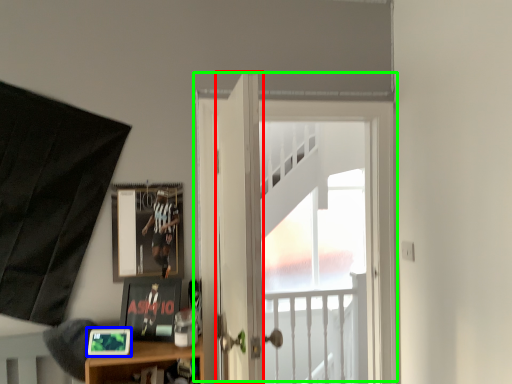
Question: Which is nearer to the door (highlighted by a red box)? picture frame (highlighted by a blue box) or door (highlighted by a green box).

Choices:
 (A) picture frame
 (B) door

Answer: (B)